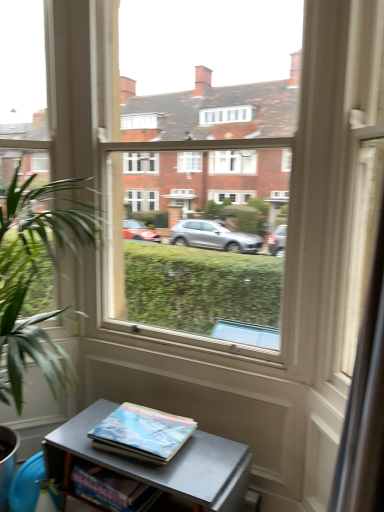
I want to click on free space above metallic gray table at lower center (from a real-world perspective), so click(x=163, y=453).